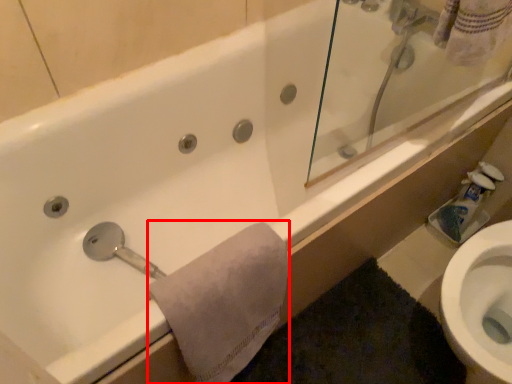
Question: From the image's perspective, where is bath towel (annotated by the red box) located in relation to toilet paper in the image?

Choices:
 (A) below
 (B) above

Answer: (A)